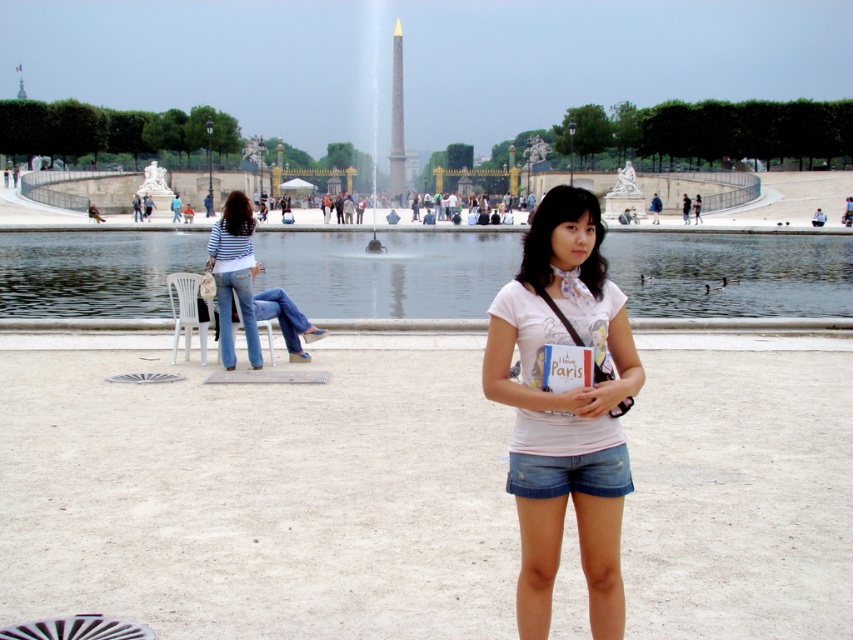
Question: Based on their relative distances, which object is nearer to the clear water at center?

Choices:
 (A) striped fabric shirt at center
 (B) denim shorts at lower center

Answer: (A)

Question: Does clear water at center have a lesser width compared to striped fabric shirt at center?

Choices:
 (A) no
 (B) yes

Answer: (A)

Question: Estimate the real-world distances between objects in this image. Which object is farther from the white cotton shirt at center?

Choices:
 (A) striped fabric shirt at center
 (B) clear water at center
 (C) denim shorts at lower center

Answer: (B)

Question: Which of these objects is positioned farthest from the white cotton shirt at center?

Choices:
 (A) clear water at center
 (B) striped fabric shirt at center

Answer: (A)

Question: Is clear water at center to the left of white cotton shirt at center from the viewer's perspective?

Choices:
 (A) yes
 (B) no

Answer: (B)

Question: Is clear water at center wider than denim shorts at lower center?

Choices:
 (A) yes
 (B) no

Answer: (A)